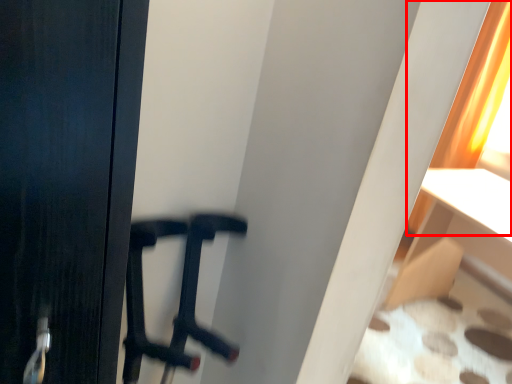
Question: Where is curtain (annotated by the red box) located in relation to furniture in the image?

Choices:
 (A) left
 (B) right

Answer: (B)